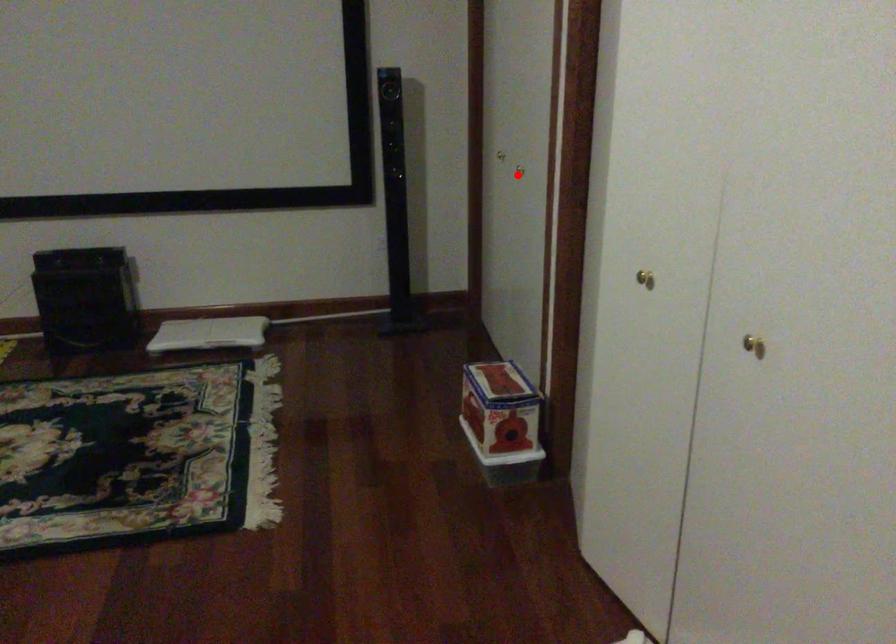
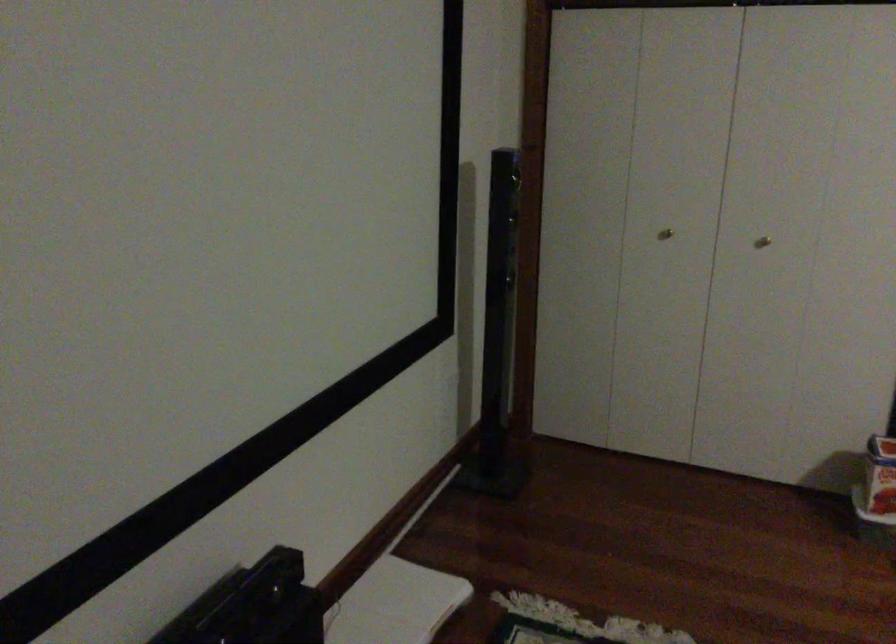
Question: I am providing you with two images of the same scene from different viewpoints. A red point is shown in image1. For the corresponding object point in image2, is it positioned nearer or farther from the camera?

Choices:
 (A) Nearer
 (B) Farther

Answer: (A)